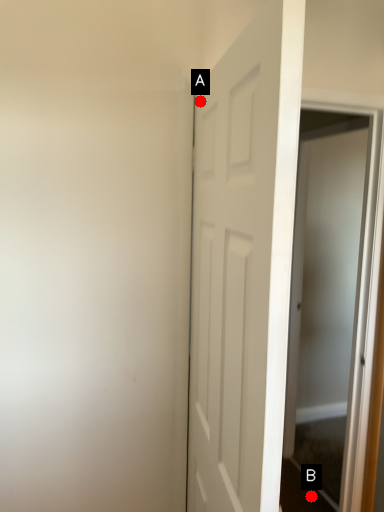
Question: Two points are circled on the image, labeled by A and B beside each circle. Which point is closer to the camera?

Choices:
 (A) A is closer
 (B) B is closer

Answer: (A)